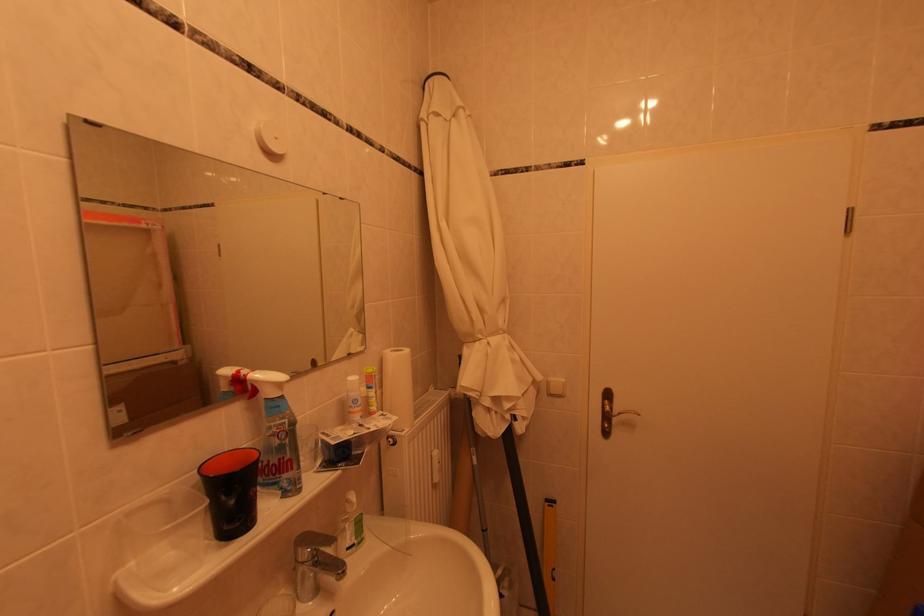
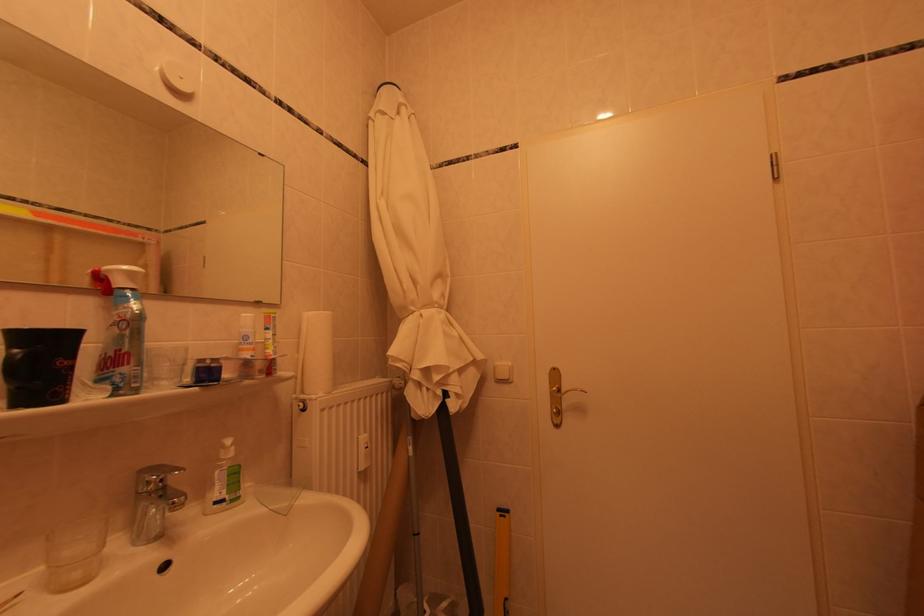
Question: The images are taken continuously from a first-person perspective. In which direction is your viewpoint rotating?

Choices:
 (A) Left
 (B) Right
 (C) Up
 (D) Down

Answer: (C)